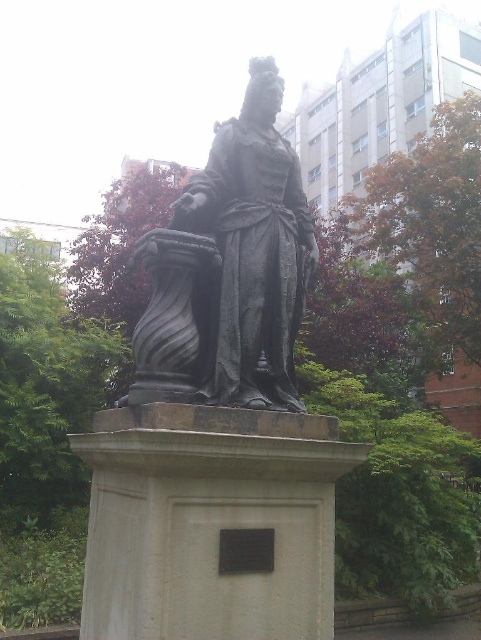
Which of these two, polished bronze statue at center or bronze statue at center, stands taller?

With more height is polished bronze statue at center.

Is polished bronze statue at center above bronze statue at center?

No.

Is point (265, 163) more distant than point (157, 237)?

Yes, point (265, 163) is farther from viewer.

Where is `polished bronze statue at center`? The height and width of the screenshot is (640, 481). polished bronze statue at center is located at coordinates (218, 417).